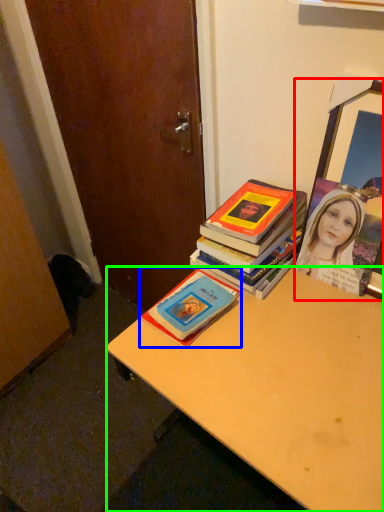
Question: Which object is the closest to the picture frame (highlighted by a red box)? Choose among these: book (highlighted by a blue box) or desk (highlighted by a green box).

Choices:
 (A) book
 (B) desk

Answer: (B)